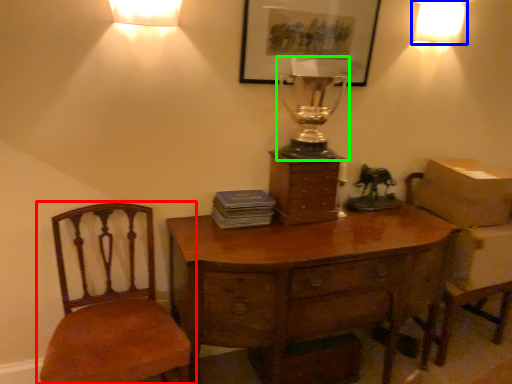
Question: Estimate the real-world distances between objects in this image. Which object is closer to chair (highlighted by a red box), lamp (highlighted by a blue box) or candle holder (highlighted by a green box)?

Choices:
 (A) lamp
 (B) candle holder

Answer: (B)